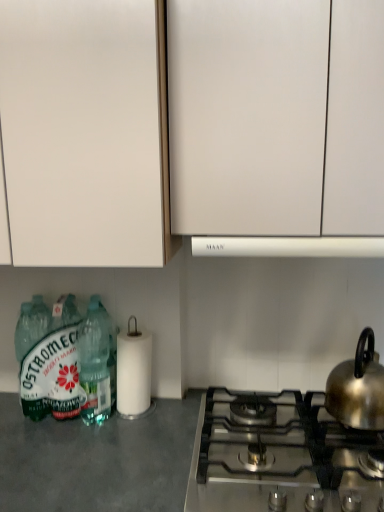
The image size is (384, 512). Find the location of `vacant space underneath white matte cabinet at upper left, the second cabinetry from the right (from a real-world perspective)`. vacant space underneath white matte cabinet at upper left, the second cabinetry from the right (from a real-world perspective) is located at coordinates (85, 432).